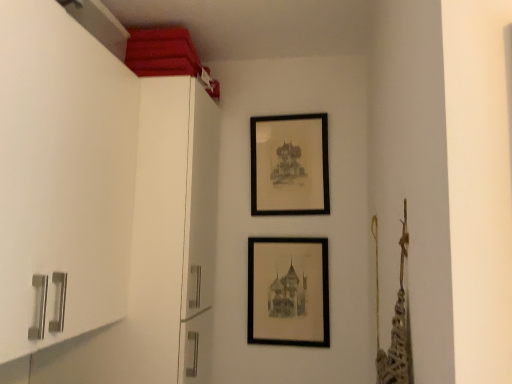
The width and height of the screenshot is (512, 384). What are the coordinates of `black matte picture frame at upper center, which is the 2th picture frame in bottom-to-top order` in the screenshot? It's located at [289, 165].

Measure the distance between point (273, 170) and camera.

The depth of point (273, 170) is 1.98 meters.

Image resolution: width=512 pixels, height=384 pixels. Describe the element at coordinates (289, 165) in the screenshot. I see `black matte picture frame at upper center, which is the 2th picture frame in bottom-to-top order` at that location.

In the scene shown: What is the approximate width of matte black picture frame at center, positioned as the 2th picture frame in top-to-bottom order?

It is 2.23 inches.

The height and width of the screenshot is (384, 512). What are the coordinates of `matte black picture frame at center, arranged as the first picture frame when ordered from the bottom` in the screenshot? It's located at (288, 292).

Describe the element at coordinates (288, 292) in the screenshot. I see `matte black picture frame at center, arranged as the first picture frame when ordered from the bottom` at that location.

Find the location of a particular element. The height and width of the screenshot is (384, 512). black matte picture frame at upper center, which is counted as the 1th picture frame, starting from the top is located at coordinates 289,165.

Considering the positions of objects black matte picture frame at upper center, which is the 2th picture frame in bottom-to-top order, and matte black picture frame at center, positioned as the 2th picture frame in top-to-bottom order, in the image provided, who is more to the right, black matte picture frame at upper center, which is the 2th picture frame in bottom-to-top order, or matte black picture frame at center, positioned as the 2th picture frame in top-to-bottom order,?

Positioned to the right is black matte picture frame at upper center, which is the 2th picture frame in bottom-to-top order.

Consider the image. In the image, is black matte picture frame at upper center, which is the 2th picture frame in bottom-to-top order, positioned in front of or behind matte black picture frame at center, positioned as the 2th picture frame in top-to-bottom order?

Visually, black matte picture frame at upper center, which is the 2th picture frame in bottom-to-top order, is located behind matte black picture frame at center, positioned as the 2th picture frame in top-to-bottom order.

From the picture: Which point is more forward, [314,158] or [264,338]?

The point [264,338] is closer to the camera.

From the image's perspective, is black matte picture frame at upper center, which is the 2th picture frame in bottom-to-top order, on matte black picture frame at center, arranged as the first picture frame when ordered from the bottom?

Yes.

From a real-world perspective, which is physically below, black matte picture frame at upper center, which is counted as the 1th picture frame, starting from the top, or matte black picture frame at center, arranged as the first picture frame when ordered from the bottom?

From a 3D spatial view, matte black picture frame at center, arranged as the first picture frame when ordered from the bottom, is below.

From the picture: Between black matte picture frame at upper center, which is counted as the 1th picture frame, starting from the top, and matte black picture frame at center, arranged as the first picture frame when ordered from the bottom, which one has smaller width?

Thinner between the two is matte black picture frame at center, arranged as the first picture frame when ordered from the bottom.

Considering the sizes of black matte picture frame at upper center, which is counted as the 1th picture frame, starting from the top, and matte black picture frame at center, positioned as the 2th picture frame in top-to-bottom order, in the image, is black matte picture frame at upper center, which is counted as the 1th picture frame, starting from the top, taller or shorter than matte black picture frame at center, positioned as the 2th picture frame in top-to-bottom order,?

In the image, black matte picture frame at upper center, which is counted as the 1th picture frame, starting from the top, appears to be taller than matte black picture frame at center, positioned as the 2th picture frame in top-to-bottom order.

Between black matte picture frame at upper center, which is the 2th picture frame in bottom-to-top order, and matte black picture frame at center, arranged as the first picture frame when ordered from the bottom, which one has smaller size?

matte black picture frame at center, arranged as the first picture frame when ordered from the bottom, is smaller.

Is black matte picture frame at upper center, which is counted as the 1th picture frame, starting from the top, located outside matte black picture frame at center, positioned as the 2th picture frame in top-to-bottom order?

Indeed, black matte picture frame at upper center, which is counted as the 1th picture frame, starting from the top, is completely outside matte black picture frame at center, positioned as the 2th picture frame in top-to-bottom order.

Does black matte picture frame at upper center, which is counted as the 1th picture frame, starting from the top, touch matte black picture frame at center, positioned as the 2th picture frame in top-to-bottom order?

No, black matte picture frame at upper center, which is counted as the 1th picture frame, starting from the top, is not making contact with matte black picture frame at center, positioned as the 2th picture frame in top-to-bottom order.

Is matte black picture frame at center, arranged as the first picture frame when ordered from the bottom, at the back of black matte picture frame at upper center, which is counted as the 1th picture frame, starting from the top?

That's not correct — black matte picture frame at upper center, which is counted as the 1th picture frame, starting from the top, is not looking away from matte black picture frame at center, arranged as the first picture frame when ordered from the bottom.

How distant is black matte picture frame at upper center, which is the 2th picture frame in bottom-to-top order, from matte black picture frame at center, arranged as the first picture frame when ordered from the bottom?

They are 13.86 inches apart.

Locate an element on the screen. This screenshot has height=384, width=512. picture frame above the matte black picture frame at center, positioned as the 2th picture frame in top-to-bottom order (from the image's perspective) is located at coordinates (289, 165).

Which is more to the right, matte black picture frame at center, positioned as the 2th picture frame in top-to-bottom order, or black matte picture frame at upper center, which is the 2th picture frame in bottom-to-top order?

black matte picture frame at upper center, which is the 2th picture frame in bottom-to-top order.

Does matte black picture frame at center, positioned as the 2th picture frame in top-to-bottom order, lie in front of black matte picture frame at upper center, which is counted as the 1th picture frame, starting from the top?

Yes, it is in front of black matte picture frame at upper center, which is counted as the 1th picture frame, starting from the top.

Between point (261, 318) and point (278, 188), which one is positioned behind?

The point (278, 188) is farther.

From the image's perspective, is matte black picture frame at center, positioned as the 2th picture frame in top-to-bottom order, over black matte picture frame at upper center, which is the 2th picture frame in bottom-to-top order?

No, from the image's perspective, matte black picture frame at center, positioned as the 2th picture frame in top-to-bottom order, is not on top of black matte picture frame at upper center, which is the 2th picture frame in bottom-to-top order.

Consider the image. From a real-world perspective, which is physically above, matte black picture frame at center, positioned as the 2th picture frame in top-to-bottom order, or black matte picture frame at upper center, which is the 2th picture frame in bottom-to-top order?

In real-world perspective, black matte picture frame at upper center, which is the 2th picture frame in bottom-to-top order, is above.

Which of these two, matte black picture frame at center, arranged as the first picture frame when ordered from the bottom, or black matte picture frame at upper center, which is counted as the 1th picture frame, starting from the top, is thinner?

matte black picture frame at center, arranged as the first picture frame when ordered from the bottom, is thinner.

Can you confirm if matte black picture frame at center, positioned as the 2th picture frame in top-to-bottom order, is taller than black matte picture frame at upper center, which is the 2th picture frame in bottom-to-top order?

Incorrect, the height of matte black picture frame at center, positioned as the 2th picture frame in top-to-bottom order, is not larger of that of black matte picture frame at upper center, which is the 2th picture frame in bottom-to-top order.

Is matte black picture frame at center, arranged as the first picture frame when ordered from the bottom, smaller than black matte picture frame at upper center, which is the 2th picture frame in bottom-to-top order?

Indeed, matte black picture frame at center, arranged as the first picture frame when ordered from the bottom, has a smaller size compared to black matte picture frame at upper center, which is the 2th picture frame in bottom-to-top order.

Is matte black picture frame at center, arranged as the first picture frame when ordered from the bottom, not within black matte picture frame at upper center, which is counted as the 1th picture frame, starting from the top?

matte black picture frame at center, arranged as the first picture frame when ordered from the bottom, is positioned outside black matte picture frame at upper center, which is counted as the 1th picture frame, starting from the top.

Is matte black picture frame at center, arranged as the first picture frame when ordered from the bottom, beside black matte picture frame at upper center, which is the 2th picture frame in bottom-to-top order?

No, matte black picture frame at center, arranged as the first picture frame when ordered from the bottom, is not in contact with black matte picture frame at upper center, which is the 2th picture frame in bottom-to-top order.

Is matte black picture frame at center, arranged as the first picture frame when ordered from the bottom, looking in the opposite direction of black matte picture frame at upper center, which is counted as the 1th picture frame, starting from the top?

No, black matte picture frame at upper center, which is counted as the 1th picture frame, starting from the top, is not at the back of matte black picture frame at center, arranged as the first picture frame when ordered from the bottom.

I want to click on picture frame on the left side of black matte picture frame at upper center, which is the 2th picture frame in bottom-to-top order, so click(288, 292).

The width and height of the screenshot is (512, 384). I want to click on picture frame on the left of black matte picture frame at upper center, which is the 2th picture frame in bottom-to-top order, so click(288, 292).

This screenshot has width=512, height=384. In order to click on picture frame behind the matte black picture frame at center, positioned as the 2th picture frame in top-to-bottom order in this screenshot , I will do `click(289, 165)`.